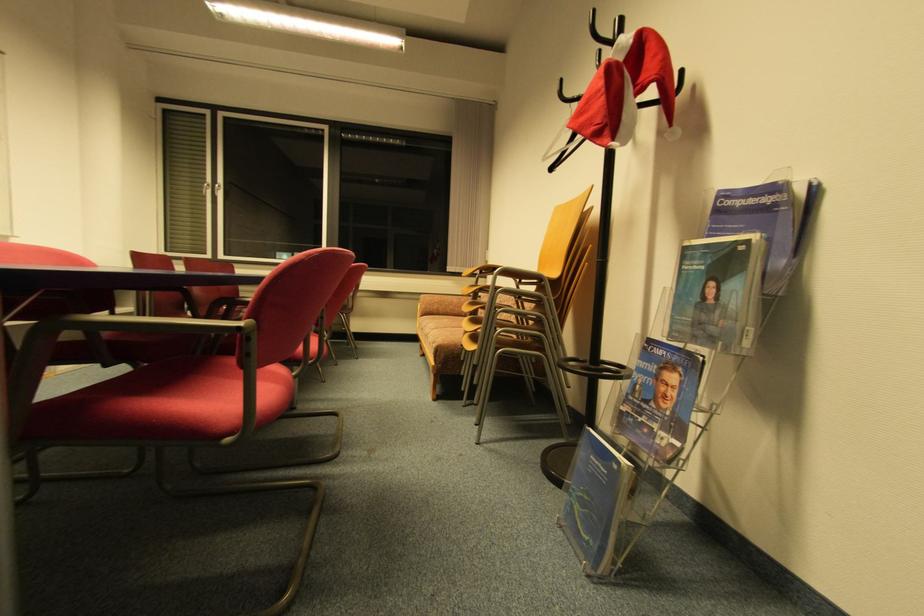
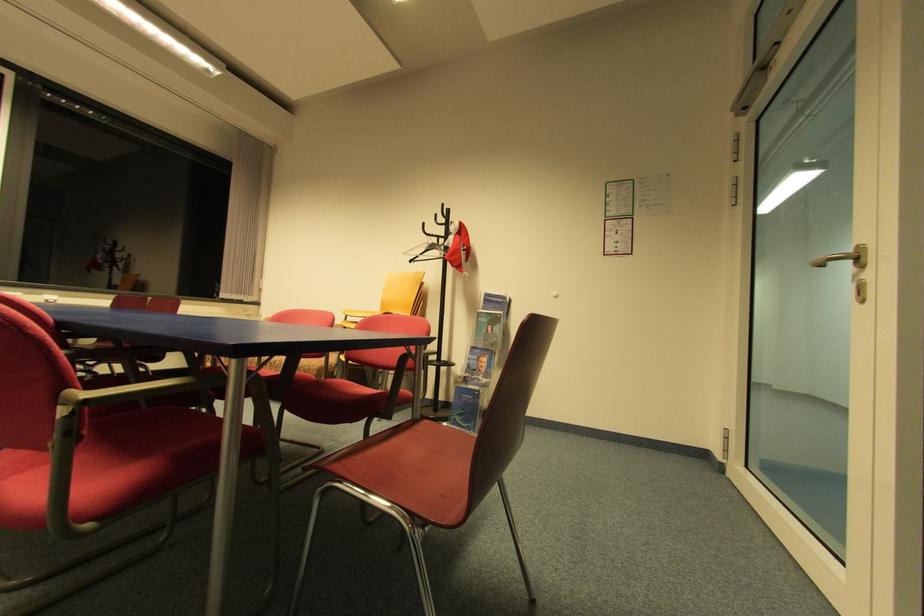
The point at (550, 160) is marked in the first image. Where is the corresponding point in the second image?

(408, 254)